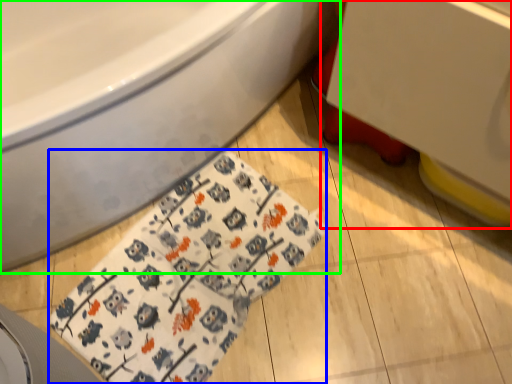
Question: Considering the real-world distances, which object is farthest from sink (highlighted by a red box)? blanket (highlighted by a blue box) or bathtub (highlighted by a green box)?

Choices:
 (A) blanket
 (B) bathtub

Answer: (A)